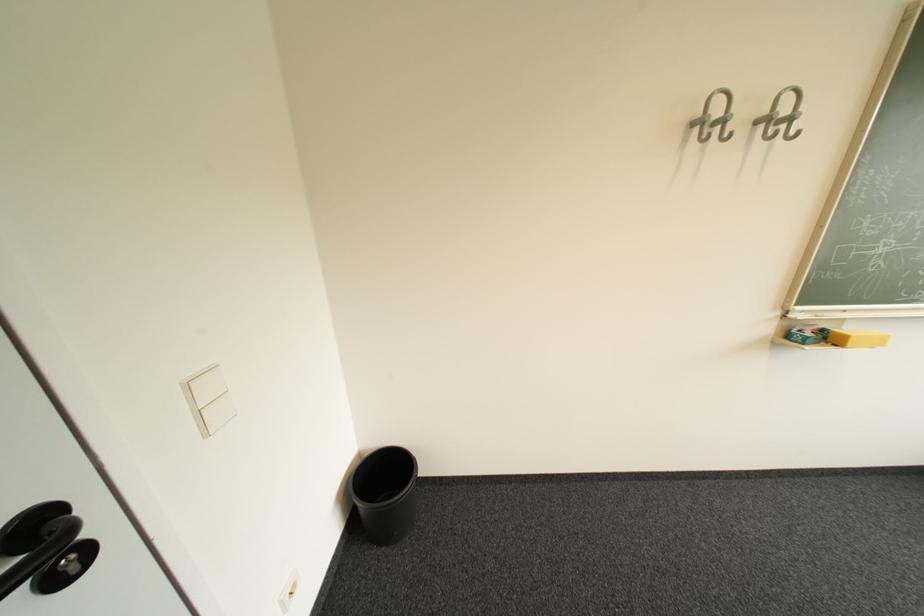
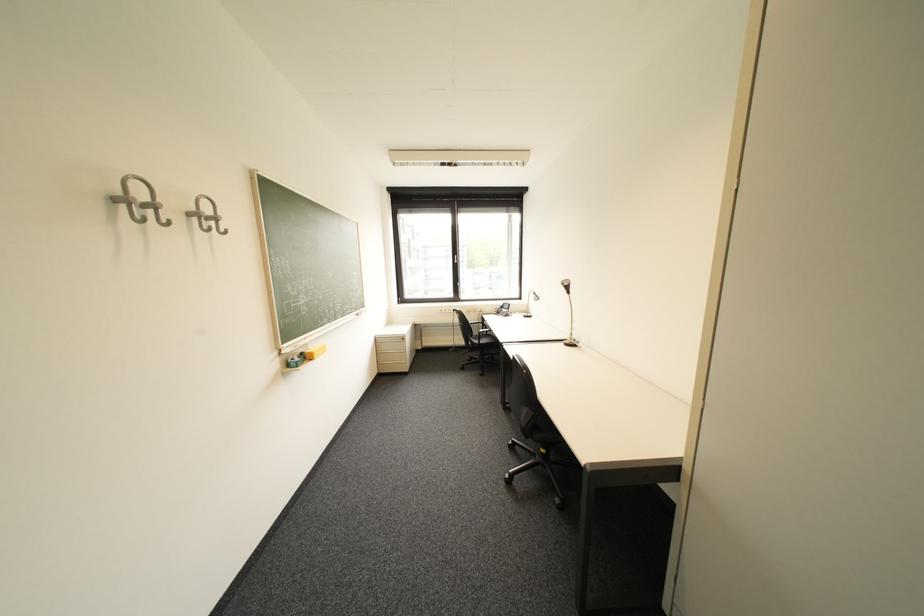
The point at (708, 123) is marked in the first image. Where is the corresponding point in the second image?

(130, 201)